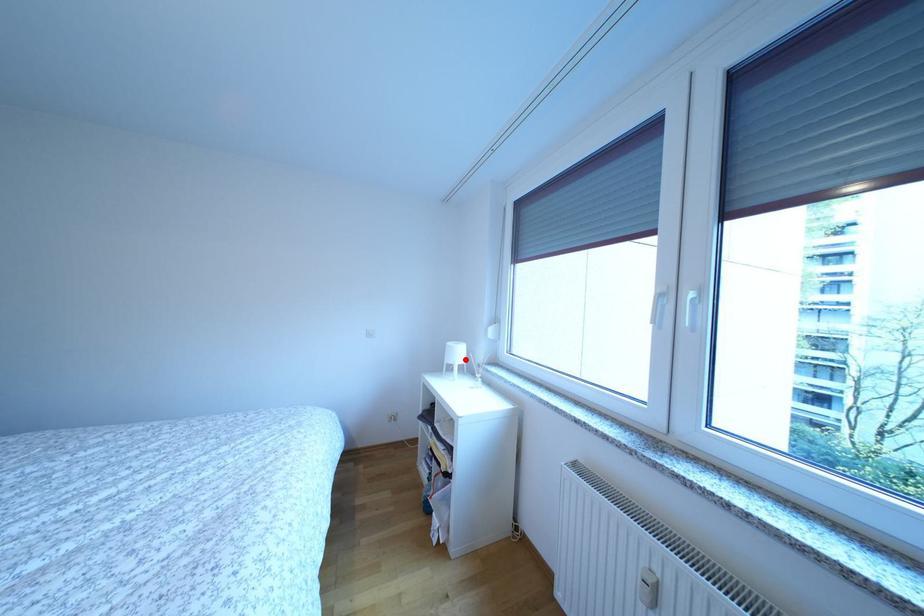
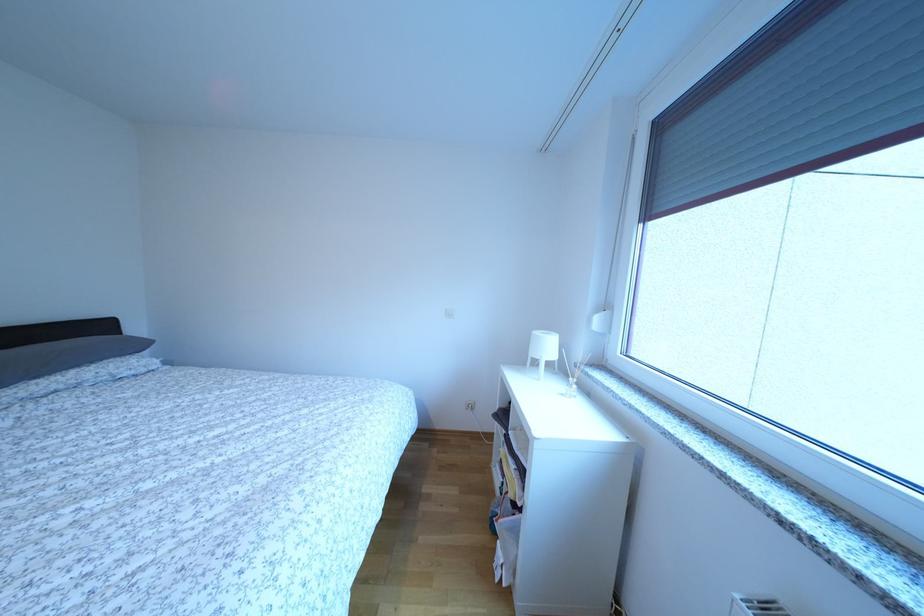
Find the pixel in the second image that matches the highlighted location in the first image.

(554, 353)